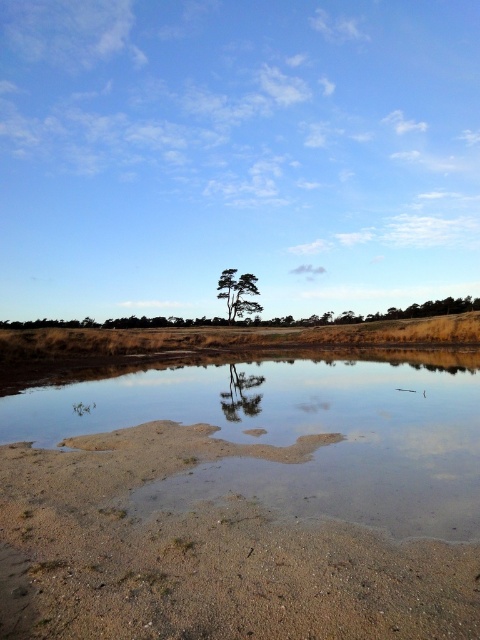
Question: Which object appears closest to the camera in this image?

Choices:
 (A) green matte tree at center
 (B) smooth glass tree at center

Answer: (B)

Question: Can you confirm if brown sandy dirt at lower center is positioned to the left of smooth glass tree at center?

Choices:
 (A) no
 (B) yes

Answer: (B)

Question: Can you confirm if brown sandy dirt at lower center is positioned to the right of green matte tree at center?

Choices:
 (A) yes
 (B) no

Answer: (A)

Question: Which point is farther to the camera?

Choices:
 (A) (239, 310)
 (B) (181, 564)
 (C) (331, 378)
 (D) (232, 416)

Answer: (A)

Question: Which point is farther from the camera taking this photo?

Choices:
 (A) (199, 444)
 (B) (236, 401)

Answer: (B)

Question: Is brown sandy dirt at lower center positioned behind clear water at center?

Choices:
 (A) no
 (B) yes

Answer: (B)